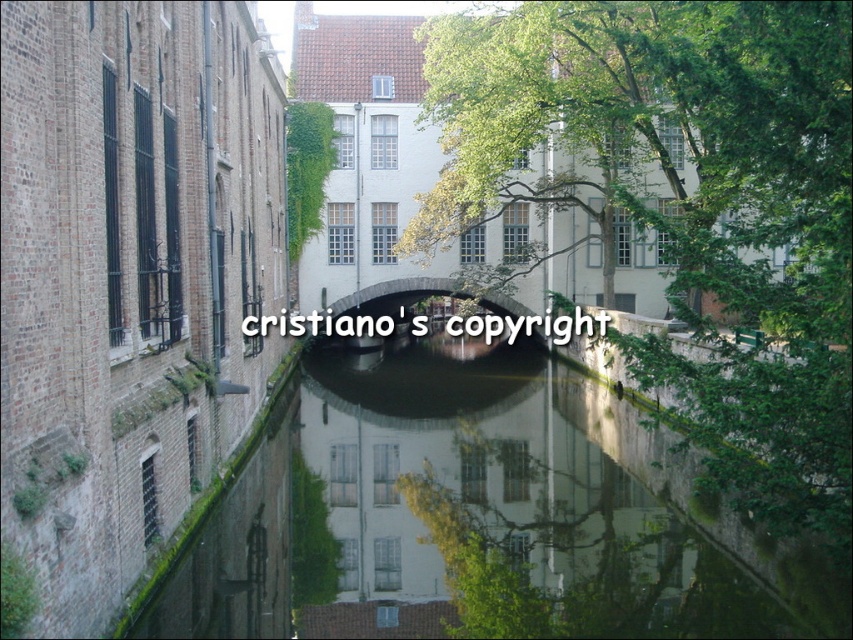
Does green mossy water at center have a greater width compared to matte stone bridge at center?

Yes.

Locate an element on the screen. This screenshot has height=640, width=853. green mossy water at center is located at coordinates (479, 509).

Locate an element on the screen. This screenshot has height=640, width=853. green mossy water at center is located at coordinates (479, 509).

This screenshot has width=853, height=640. Find the location of `green mossy water at center`. green mossy water at center is located at coordinates (479, 509).

Can you confirm if green mossy water at center is positioned above green leafy tree at center?

No, green mossy water at center is not above green leafy tree at center.

Can you confirm if green mossy water at center is bigger than green leafy tree at center?

No.

Does point (204, 620) come farther from viewer compared to point (770, 308)?

Yes, point (204, 620) is farther from viewer.

At what (x,y) coordinates should I click in order to perform the action: click on green mossy water at center. Please return your answer as a coordinate pair (x, y). Looking at the image, I should click on (479, 509).

Is green leafy tree at center wider than matte stone bridge at center?

Correct, the width of green leafy tree at center exceeds that of matte stone bridge at center.

Who is more distant from viewer, (583, 122) or (509, 305)?

The point (509, 305) is behind.

The height and width of the screenshot is (640, 853). Find the location of `green leafy tree at center`. green leafy tree at center is located at coordinates (689, 202).